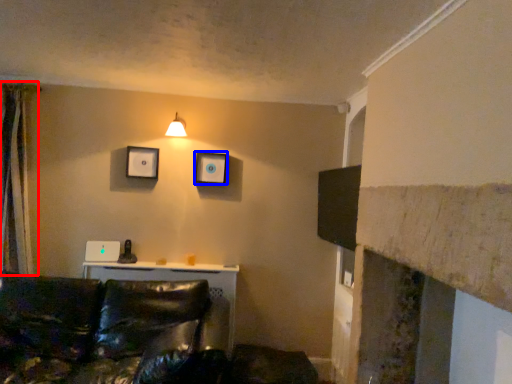
Question: Which object appears closest to the camera in this image, curtain (highlighted by a red box) or picture frame (highlighted by a blue box)?

Choices:
 (A) curtain
 (B) picture frame

Answer: (A)